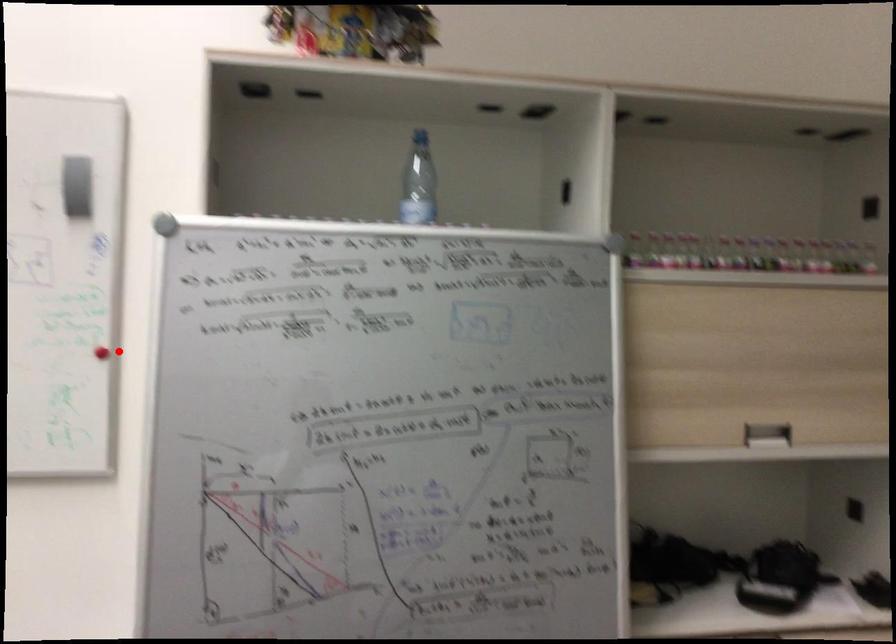
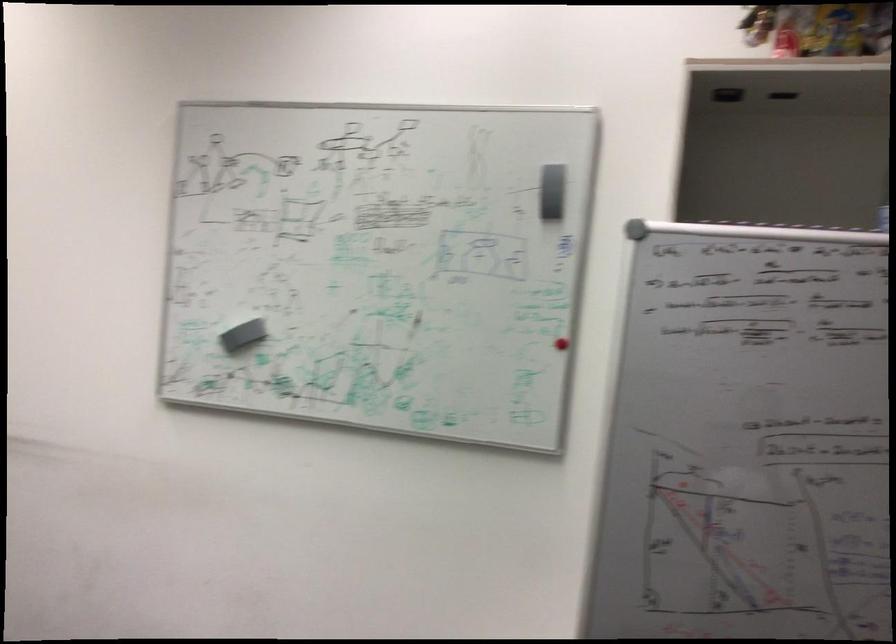
In the second image, find the point that corresponds to the highlighted location in the first image.

(564, 341)